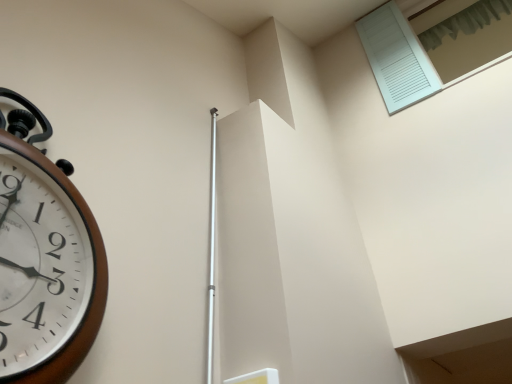
Question: Based on their sizes in the image, would you say brown wooden wall clock at left is bigger or smaller than white textured shutter at upper right, which ranks as the second window in bottom-to-top order?

Choices:
 (A) small
 (B) big

Answer: (B)

Question: Is point (71, 364) closer or farther from the camera than point (456, 69)?

Choices:
 (A) closer
 (B) farther

Answer: (A)

Question: Which object is the farthest from the white textured shutter at upper right, the 1th window viewed from the top?

Choices:
 (A) brown wooden wall clock at left
 (B) white matte shutter at upper right, the 1th window in the bottom-to-top sequence

Answer: (A)

Question: Based on their relative distances, which object is farther from the white matte shutter at upper right, the 2th window in the top-to-bottom sequence?

Choices:
 (A) brown wooden wall clock at left
 (B) white textured shutter at upper right, which ranks as the second window in bottom-to-top order

Answer: (A)